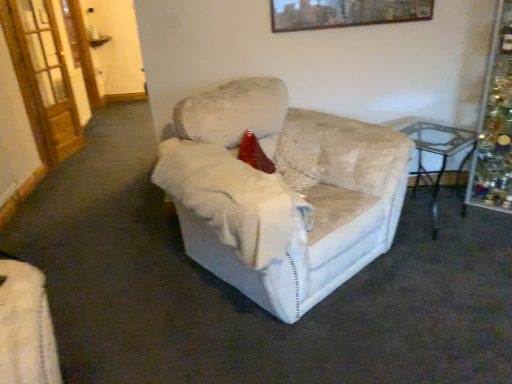
In the scene shown: In order to face transparent glass table at right, should I rotate leftwards or rightwards?

To face it directly, rotate right by 22.461 degrees.

In order to face velvet beige armchair at center, should I rotate leftwards or rightwards?

Rotate your view right by about 3.558°.

Measure the distance between point (329, 5) and camera.

The distance of point (329, 5) from camera is 8.50 feet.

What do you see at coordinates (495, 123) in the screenshot? I see `shiny metallic tinsel at right` at bounding box center [495, 123].

What do you see at coordinates (42, 77) in the screenshot? The height and width of the screenshot is (384, 512). I see `wooden door at left` at bounding box center [42, 77].

Where is `transparent glass table at right`? This screenshot has height=384, width=512. transparent glass table at right is located at coordinates (436, 154).

Considering the sizes of wooden framed artwork at upper center and velvet red pillow at center in the image, is wooden framed artwork at upper center bigger or smaller than velvet red pillow at center?

wooden framed artwork at upper center is smaller than velvet red pillow at center.

From a real-world perspective, which object stands above the other?

wooden framed artwork at upper center is physically above.

Is wooden framed artwork at upper center located outside velvet red pillow at center?

Yes, wooden framed artwork at upper center is located beyond the bounds of velvet red pillow at center.

From the image's perspective, which one is positioned lower, wooden door at left or transparent glass table at right?

transparent glass table at right.

Who is shorter, wooden door at left or transparent glass table at right?

With less height is transparent glass table at right.

Based on the photo, how different are the orientations of wooden door at left and transparent glass table at right in degrees?

44.3 degrees.

Locate an element on the screen. glass door above the transparent glass table at right (from a real-world perspective) is located at coordinates (42, 77).

Considering the sizes of objects wooden door at left and shiny metallic tinsel at right in the image provided, who is bigger, wooden door at left or shiny metallic tinsel at right?

shiny metallic tinsel at right is bigger.

Is wooden door at left not within shiny metallic tinsel at right?

Yes.

How different are the orientations of wooden door at left and shiny metallic tinsel at right in degrees?

114 degrees.

Between wooden door at left and shiny metallic tinsel at right, which one appears on the right side from the viewer's perspective?

shiny metallic tinsel at right.

Based on the photo, could you tell me if velvet red pillow at center is facing wooden door at left?

No, velvet red pillow at center is not facing towards wooden door at left.

Which is in front, velvet red pillow at center or wooden door at left?

velvet red pillow at center is in front.

From the image's perspective, is velvet red pillow at center under wooden door at left?

Correct, velvet red pillow at center appears lower than wooden door at left in the image.

The width and height of the screenshot is (512, 384). In order to click on table beneath the velvet red pillow at center (from a real-world perspective) in this screenshot , I will do `click(436, 154)`.

Is velvet red pillow at center next to transparent glass table at right and touching it?

No, velvet red pillow at center is not with transparent glass table at right.

Is velvet red pillow at center outside of transparent glass table at right?

Indeed, velvet red pillow at center is completely outside transparent glass table at right.

Looking at the image, does shiny metallic tinsel at right seem bigger or smaller compared to wooden framed artwork at upper center?

Clearly, shiny metallic tinsel at right is larger in size than wooden framed artwork at upper center.

Which point is more distant from viewer, (510,35) or (412,6)?

Point (412,6)

Is shiny metallic tinsel at right oriented towards wooden framed artwork at upper center?

No, shiny metallic tinsel at right is not facing towards wooden framed artwork at upper center.

Which object is wider, shiny metallic tinsel at right or wooden framed artwork at upper center?

shiny metallic tinsel at right is wider.

From a real-world perspective, which object rests below the other?

From a 3D spatial view, transparent glass table at right is below.

From the image's perspective, is transparent glass table at right located beneath wooden framed artwork at upper center?

Yes, from the image's perspective, transparent glass table at right is beneath wooden framed artwork at upper center.

Considering the relative positions of transparent glass table at right and wooden framed artwork at upper center in the image provided, is transparent glass table at right in front of wooden framed artwork at upper center?

Yes, it is in front of wooden framed artwork at upper center.

Identify the location of pillow on the left of wooden framed artwork at upper center. Image resolution: width=512 pixels, height=384 pixels. (297, 163).

This screenshot has height=384, width=512. In order to click on table that is under the wooden door at left (from a real-world perspective) in this screenshot , I will do `click(436, 154)`.

Estimate the real-world distances between objects in this image. Which object is further from shiny metallic tinsel at right, velvet beige armchair at center or wooden door at left?

wooden door at left is further to shiny metallic tinsel at right.

Estimate the real-world distances between objects in this image. Which object is closer to wooden door at left, shiny metallic tinsel at right or velvet red pillow at center?

Based on the image, velvet red pillow at center appears to be nearer to wooden door at left.

Based on their spatial positions, is shiny metallic tinsel at right or velvet red pillow at center further from wooden framed artwork at upper center?

shiny metallic tinsel at right is further to wooden framed artwork at upper center.

Based on their spatial positions, is velvet red pillow at center or shiny metallic tinsel at right closer to wooden framed artwork at upper center?

Based on the image, velvet red pillow at center appears to be nearer to wooden framed artwork at upper center.

Which object lies further to the anchor point wooden door at left, velvet beige armchair at center or wooden framed artwork at upper center?

velvet beige armchair at center.

Estimate the real-world distances between objects in this image. Which object is closer to wooden framed artwork at upper center, shiny metallic tinsel at right or wooden door at left?

shiny metallic tinsel at right is closer to wooden framed artwork at upper center.

Consider the image. When comparing their distances from shiny metallic tinsel at right, does velvet beige armchair at center or velvet red pillow at center seem further?

The object further to shiny metallic tinsel at right is velvet beige armchair at center.

From the image, which object appears to be farther from wooden framed artwork at upper center, wooden door at left or velvet red pillow at center?

wooden door at left is positioned further to the anchor wooden framed artwork at upper center.

Identify the location of chair between wooden door at left and transparent glass table at right from left to right. (281, 194).

This screenshot has height=384, width=512. Find the location of `chair located between wooden door at left and shiny metallic tinsel at right in the left-right direction`. chair located between wooden door at left and shiny metallic tinsel at right in the left-right direction is located at coordinates (281, 194).

Locate an element on the screen. The width and height of the screenshot is (512, 384). pillow located between wooden door at left and shiny metallic tinsel at right in the left-right direction is located at coordinates 297,163.

At what (x,y) coordinates should I click in order to perform the action: click on chair between wooden door at left and velvet red pillow at center from left to right. Please return your answer as a coordinate pair (x, y). Looking at the image, I should click on (281, 194).